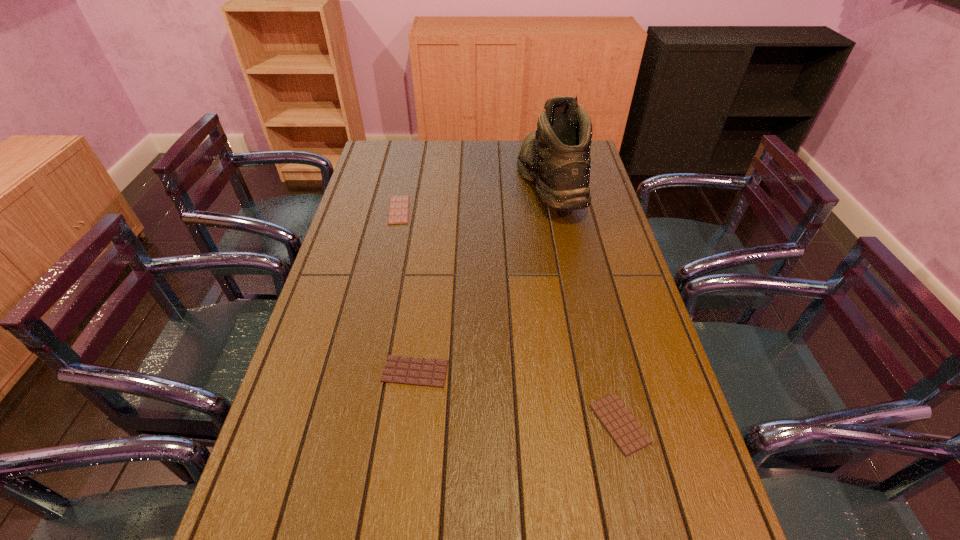
Identify the location of ski boot. (556, 157).

Locate an element on the screen. The width and height of the screenshot is (960, 540). the nearest chocolate bar is located at coordinates (628, 435).

I want to click on the nearest object, so click(628, 435).

Locate an element on the screen. the farthest chocolate bar is located at coordinates (398, 213).

Identify the location of the leftmost object. (398, 213).

Find the location of a particular element. The height and width of the screenshot is (540, 960). the second chocolate bar from right to left is located at coordinates (417, 371).

Identify the location of the second farthest chocolate bar. The width and height of the screenshot is (960, 540). (417, 371).

Locate an element on the screen. This screenshot has height=540, width=960. vacant space located on the front of the ski boot is located at coordinates (572, 303).

The image size is (960, 540). What are the coordinates of `free space located 0.250m on the left of the nearest object` in the screenshot? It's located at (482, 424).

Image resolution: width=960 pixels, height=540 pixels. What are the coordinates of `free space located on the right of the leftmost chocolate bar` in the screenshot? It's located at (492, 210).